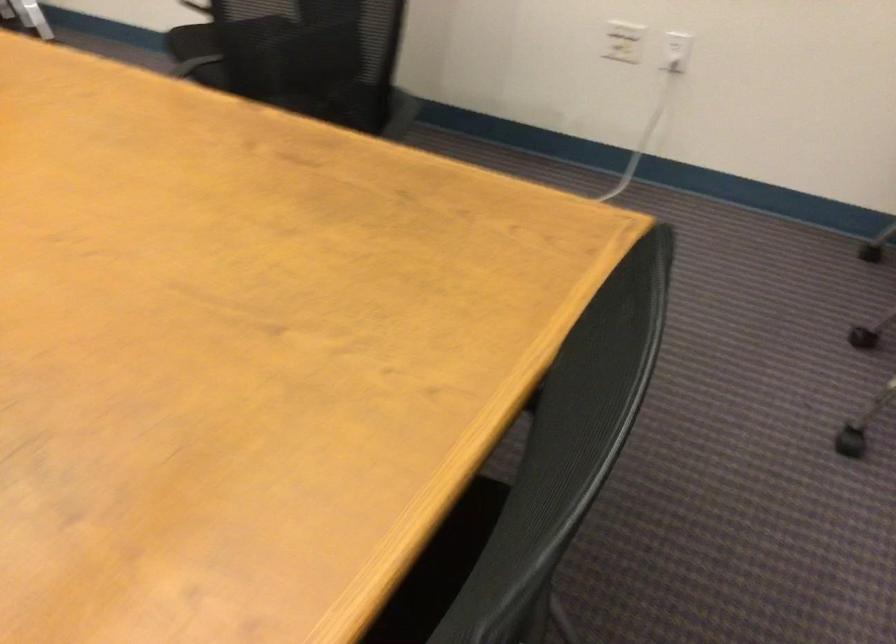
What do you see at coordinates (271, 91) in the screenshot? This screenshot has width=896, height=644. I see `the chair sitting surface` at bounding box center [271, 91].